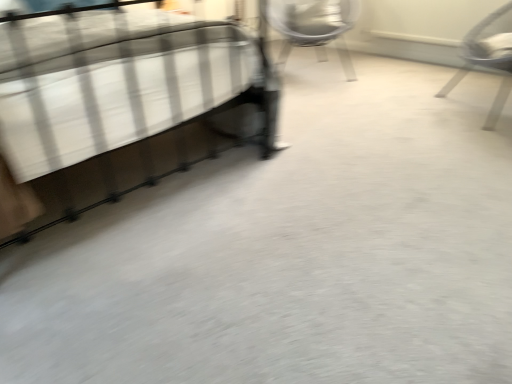
The height and width of the screenshot is (384, 512). I want to click on vacant area that lies in front of metallic silver bed at left, so click(189, 279).